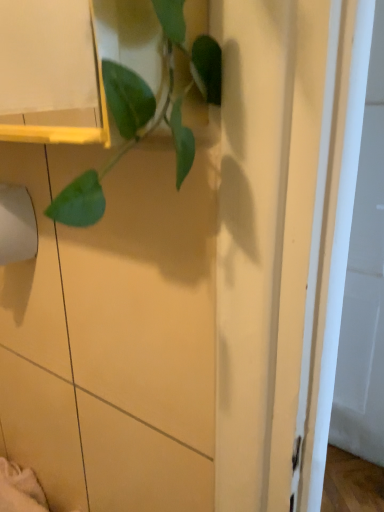
Identify the location of green leafy plant at upper left. (146, 111).

The width and height of the screenshot is (384, 512). What do you see at coordinates (146, 111) in the screenshot?
I see `green leafy plant at upper left` at bounding box center [146, 111].

This screenshot has width=384, height=512. I want to click on white matte toilet paper at left, so click(17, 225).

Describe the element at coordinates (17, 225) in the screenshot. I see `white matte toilet paper at left` at that location.

This screenshot has width=384, height=512. Find the location of `green leafy plant at upper left`. green leafy plant at upper left is located at coordinates (146, 111).

Is green leafy plant at upper left to the right of white matte toilet paper at left from the viewer's perspective?

Indeed, green leafy plant at upper left is positioned on the right side of white matte toilet paper at left.

Is green leafy plant at upper left in front of or behind white matte toilet paper at left in the image?

Visually, green leafy plant at upper left is located in front of white matte toilet paper at left.

Does point (138, 108) lie in front of point (14, 249)?

That is True.

From the image's perspective, is green leafy plant at upper left located above or below white matte toilet paper at left?

From the image's perspective, green leafy plant at upper left appears above white matte toilet paper at left.

From a real-world perspective, is green leafy plant at upper left on top of white matte toilet paper at left?

Yes.

In the scene shown: Considering the relative sizes of green leafy plant at upper left and white matte toilet paper at left in the image provided, is green leafy plant at upper left wider than white matte toilet paper at left?

No.

In the scene shown: In terms of height, does green leafy plant at upper left look taller or shorter compared to white matte toilet paper at left?

Considering their sizes, green leafy plant at upper left has more height than white matte toilet paper at left.

Is green leafy plant at upper left smaller than white matte toilet paper at left?

No.

Would you say green leafy plant at upper left is inside or outside white matte toilet paper at left?

green leafy plant at upper left is not inside white matte toilet paper at left, it's outside.

Is green leafy plant at upper left far from white matte toilet paper at left?

No, green leafy plant at upper left is not far from white matte toilet paper at left.

Is green leafy plant at upper left positioned with its back to white matte toilet paper at left?

Yes, green leafy plant at upper left's orientation is away from white matte toilet paper at left.

How different are the orientations of green leafy plant at upper left and white matte toilet paper at left in degrees?

The angle between the facing direction of green leafy plant at upper left and the facing direction of white matte toilet paper at left is 90 degrees.

Measure the distance from green leafy plant at upper left to white matte toilet paper at left.

11.36 inches.

This screenshot has height=512, width=384. Identify the location of houseplant that appears on the right of white matte toilet paper at left. (146, 111).

Which is more to the left, white matte toilet paper at left or green leafy plant at upper left?

Positioned to the left is white matte toilet paper at left.

Between white matte toilet paper at left and green leafy plant at upper left, which one is positioned in front?

green leafy plant at upper left is closer to the camera.

Considering the points (26, 219) and (119, 130), which point is in front, point (26, 219) or point (119, 130)?

The point (119, 130) is more forward.

From the image's perspective, is white matte toilet paper at left on top of green leafy plant at upper left?

Actually, white matte toilet paper at left appears below green leafy plant at upper left in the image.

From a real-world perspective, between white matte toilet paper at left and green leafy plant at upper left, who is vertically higher?

green leafy plant at upper left.

Considering the sizes of objects white matte toilet paper at left and green leafy plant at upper left in the image provided, who is wider, white matte toilet paper at left or green leafy plant at upper left?

white matte toilet paper at left is wider.

Considering the sizes of objects white matte toilet paper at left and green leafy plant at upper left in the image provided, who is taller, white matte toilet paper at left or green leafy plant at upper left?

green leafy plant at upper left.

Does white matte toilet paper at left have a larger size compared to green leafy plant at upper left?

Actually, white matte toilet paper at left might be smaller than green leafy plant at upper left.

Is white matte toilet paper at left situated inside green leafy plant at upper left or outside?

→ The correct answer is: outside.

Are white matte toilet paper at left and green leafy plant at upper left making contact?

No, white matte toilet paper at left is not touching green leafy plant at upper left.

Is white matte toilet paper at left aimed at green leafy plant at upper left?

No.

Can you tell me how much white matte toilet paper at left and green leafy plant at upper left differ in facing direction?

90 degrees separate the facing orientations of white matte toilet paper at left and green leafy plant at upper left.

Locate an element on the screen. houseplant above the white matte toilet paper at left (from a real-world perspective) is located at coordinates (146, 111).

Image resolution: width=384 pixels, height=512 pixels. I want to click on houseplant that is above the white matte toilet paper at left (from a real-world perspective), so click(x=146, y=111).

I want to click on toilet paper that is below the green leafy plant at upper left (from the image's perspective), so click(17, 225).